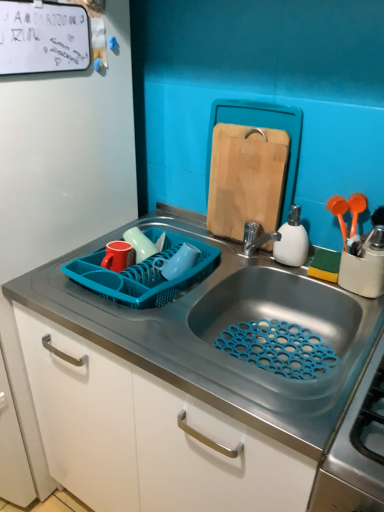
Question: Based on their sizes in the image, would you say teal plastic basket at sink is bigger or smaller than wooden cutting board at upper center?

Choices:
 (A) big
 (B) small

Answer: (A)

Question: From a real-world perspective, is teal plastic basket at sink above or below wooden cutting board at upper center?

Choices:
 (A) above
 (B) below

Answer: (B)

Question: Which of these objects is positioned closest to the blue plastic dish rack at left?

Choices:
 (A) wooden cutting board at upper center
 (B) white matte dry erase board at upper left
 (C) teal plastic basket at sink
 (D) white matte soap dispenser at right
 (E) metallic sink at center

Answer: (B)

Question: Considering the real-world distances, which object is farthest from the teal plastic basket at sink?

Choices:
 (A) wooden cutting board at upper center
 (B) blue plastic dish rack at left
 (C) white matte dry erase board at upper left
 (D) white matte soap dispenser at right
 (E) metallic sink at center

Answer: (C)